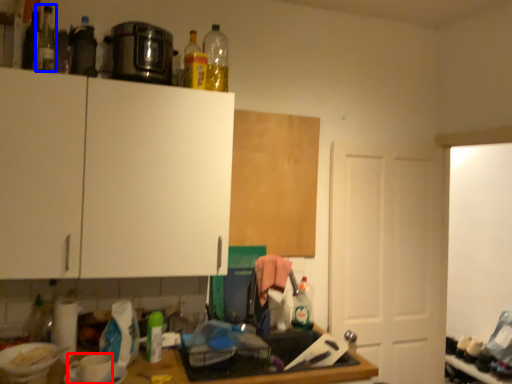
Question: Which object is further to the camera taking this photo, coffee cup (highlighted by a red box) or bottle (highlighted by a blue box)?

Choices:
 (A) coffee cup
 (B) bottle

Answer: (B)